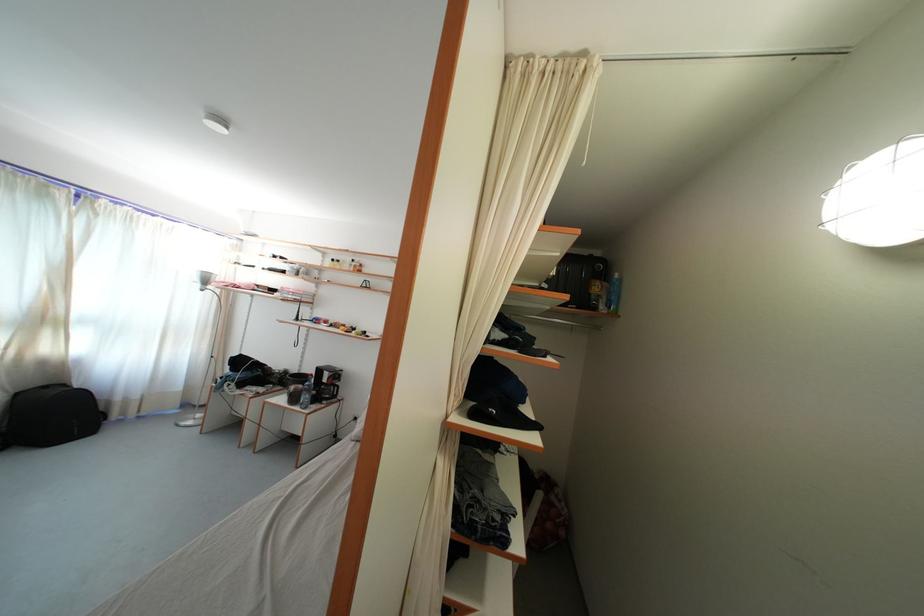
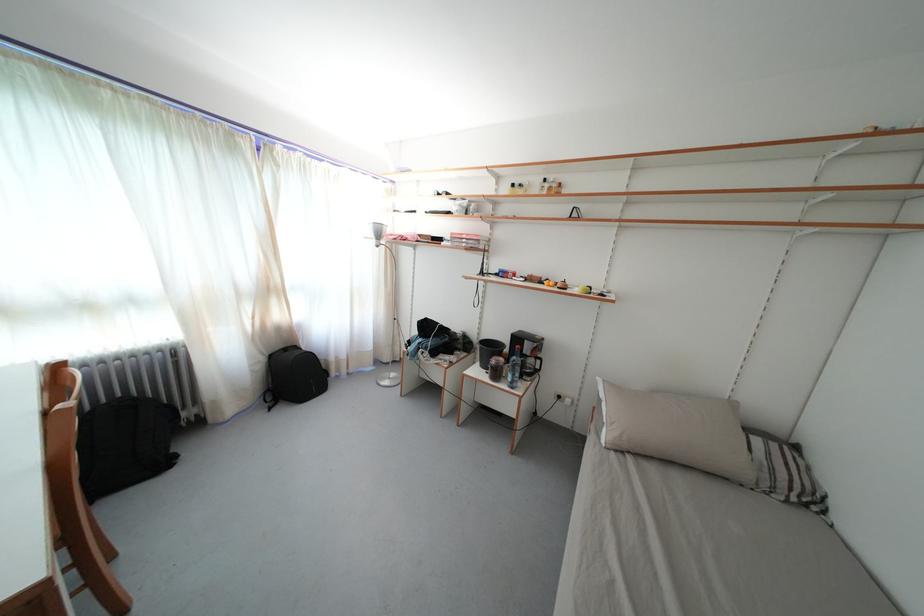
Find the pixel in the second image that matches point (325, 377) in the first image.

(524, 345)